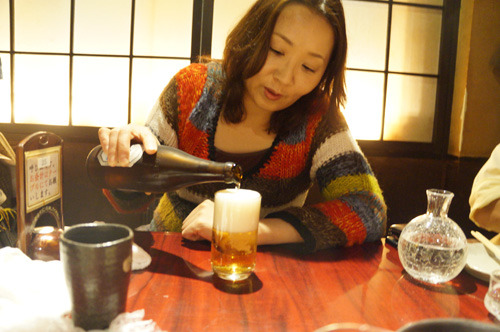
The width and height of the screenshot is (500, 332). I want to click on table, so click(237, 311).